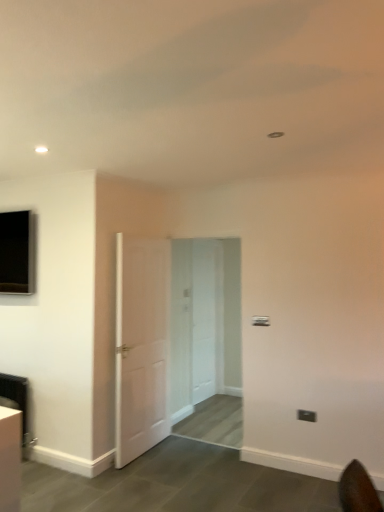
Question: Does white wooden door at center, marked as the 1th door in a right-to-left arrangement, have a greater height compared to black plastic electric outlet at lower right?

Choices:
 (A) yes
 (B) no

Answer: (A)

Question: Is white wooden door at center, which appears as the first door when viewed from the back, wider than black plastic electric outlet at lower right?

Choices:
 (A) yes
 (B) no

Answer: (A)

Question: Could you tell me if white wooden door at center, marked as the 1th door in a right-to-left arrangement, is turned towards black plastic electric outlet at lower right?

Choices:
 (A) yes
 (B) no

Answer: (B)

Question: Does white wooden door at center, marked as the 2th door in a left-to-right arrangement, have a smaller size compared to black plastic electric outlet at lower right?

Choices:
 (A) yes
 (B) no

Answer: (B)

Question: Is white wooden door at center, which appears as the first door when viewed from the back, further to camera compared to black plastic electric outlet at lower right?

Choices:
 (A) no
 (B) yes

Answer: (B)

Question: Is white wooden door at center, which appears as the first door when viewed from the back, beside black plastic electric outlet at lower right?

Choices:
 (A) yes
 (B) no

Answer: (B)

Question: Considering the relative positions of white matte door at center, which is the 1th door from left to right, and white wooden door at center, which appears as the first door when viewed from the back, in the image provided, is white matte door at center, which is the 1th door from left to right, to the left of white wooden door at center, which appears as the first door when viewed from the back, from the viewer's perspective?

Choices:
 (A) yes
 (B) no

Answer: (A)

Question: Is white matte door at center, the 2th door viewed from the back, in contact with white wooden door at center, arranged as the 2th door when viewed from the front?

Choices:
 (A) yes
 (B) no

Answer: (B)

Question: From the image's perspective, would you say white matte door at center, arranged as the second door when viewed from the right, is positioned over white wooden door at center, marked as the 2th door in a left-to-right arrangement?

Choices:
 (A) yes
 (B) no

Answer: (A)

Question: Could white wooden door at center, which appears as the first door when viewed from the back, be considered to be inside white matte door at center, which is the 1th door from left to right?

Choices:
 (A) yes
 (B) no

Answer: (B)

Question: Can you confirm if white matte door at center, the 2th door viewed from the back, is smaller than white wooden door at center, arranged as the 2th door when viewed from the front?

Choices:
 (A) yes
 (B) no

Answer: (B)

Question: From a real-world perspective, is white matte door at center, arranged as the second door when viewed from the right, physically above white wooden door at center, which appears as the first door when viewed from the back?

Choices:
 (A) yes
 (B) no

Answer: (B)

Question: Is black plastic electric outlet at lower right to the right of white wooden door at center, arranged as the 2th door when viewed from the front, from the viewer's perspective?

Choices:
 (A) yes
 (B) no

Answer: (A)